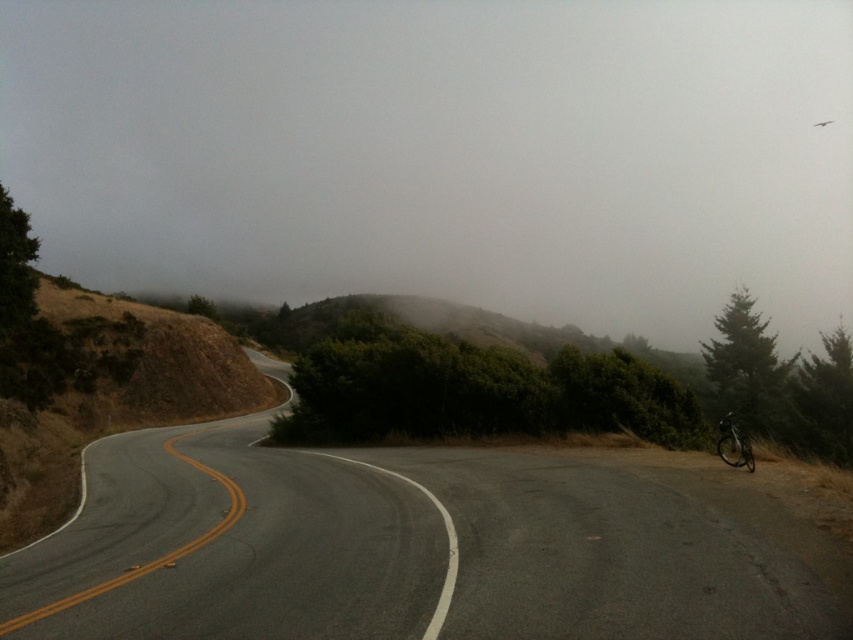
You are a delivery driver approaching the asphalt road at center. You notice a shiny black bicycle at right near the road. Can you safely pass the bicycle without changing lanes?

The asphalt road at center is bigger than the shiny black bicycle at right, so yes, you can safely pass the bicycle without changing lanes as there is sufficient space on the road.

You are a drone operator trying to capture a photo of the asphalt road at center. The camera is currently positioned at point A, which is at coordinates 0.856, 0.488. To ensure the road is centered in the photo, should you move the camera closer to the road or further away?

The asphalt road at center is already at point (x=415, y=547), which matches the camera position at point A. Therefore, the camera is already correctly positioned to center the road in the photo.

You are driving a car and see the asphalt road at center and the shiny black bicycle at right. Which object is positioned to the left of the other?

The asphalt road at center is to the left of shiny black bicycle at right.